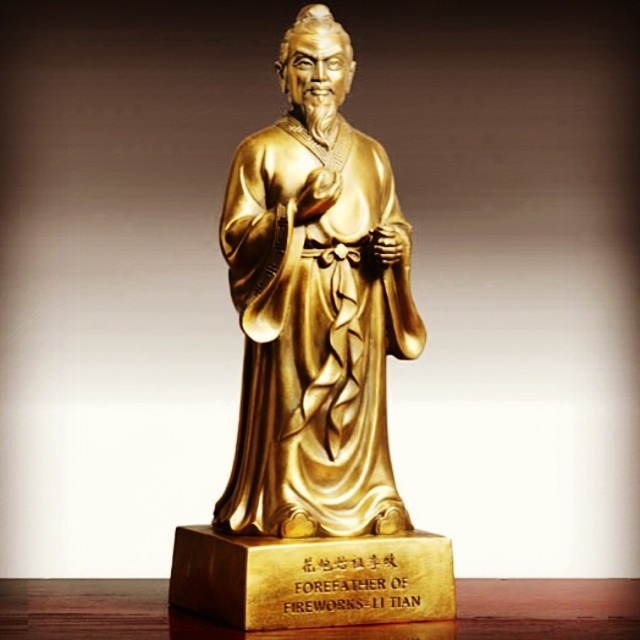
Question: Among these points, which one is nearest to the camera?

Choices:
 (A) (595, 616)
 (B) (284, 316)

Answer: (A)

Question: Does gold polished statue at center have a lesser width compared to wooden table at lower center?

Choices:
 (A) no
 (B) yes

Answer: (B)

Question: Is gold polished statue at center to the right of wooden table at lower center from the viewer's perspective?

Choices:
 (A) yes
 (B) no

Answer: (A)

Question: Which point is farther to the camera?

Choices:
 (A) (294, 49)
 (B) (618, 611)

Answer: (A)

Question: Is gold polished statue at center to the right of wooden table at lower center from the viewer's perspective?

Choices:
 (A) no
 (B) yes

Answer: (B)